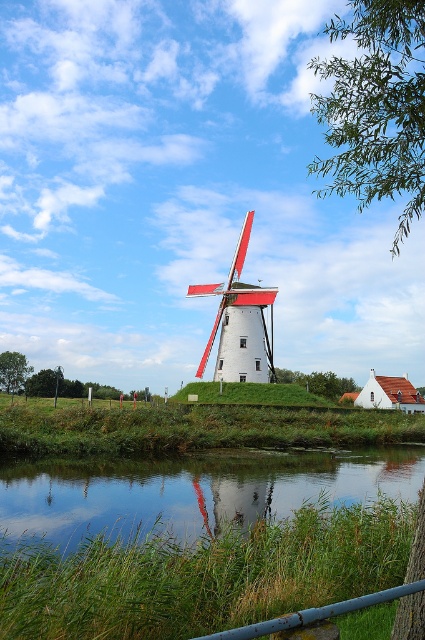
You are standing at the center of the image and want to locate the green leafy tree at upper right. According to the coordinates provided, in which direction should you look to find it?

The green leafy tree at upper right is located at coordinates point (376, 108), so you should look towards the upper right direction to find it.

In the scene shown: You are standing on the path near the metal railing at the bottom right of the windmill scene. You want to find the transparent water at lower center. Which direction should you look relative to the green leafy tree at upper right?

You should look downward towards the transparent water at lower center, which is located below the green leafy tree at upper right.

You are standing at the center of the image and want to walk towards the green leafy tree at upper right. Which direction should you move relative to the green leafy tree at lower left?

To reach the green leafy tree at upper right from the center, you should move towards the right relative to the green leafy tree at lower left, since the green leafy tree at upper right is positioned to the right of the green leafy tree at lower left.